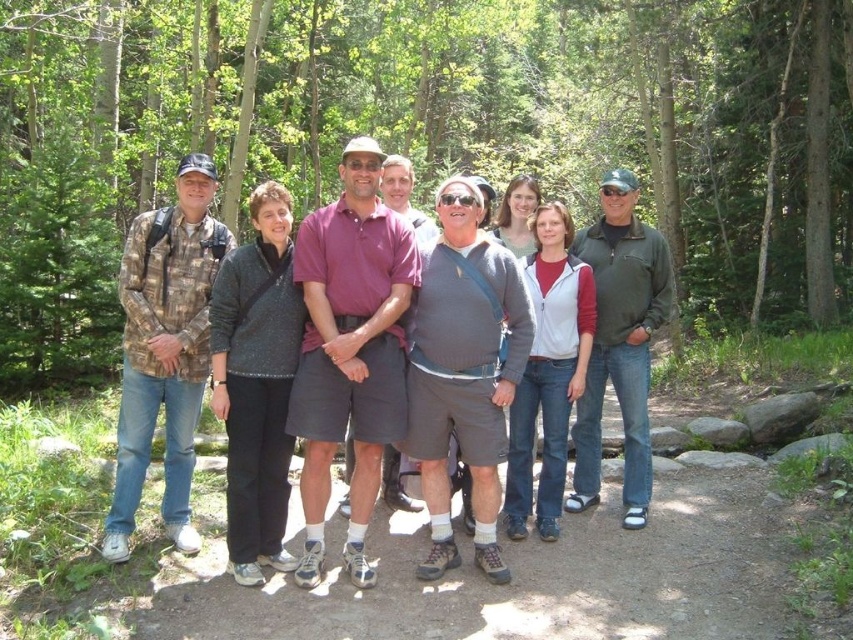
Is green leafy trees at center smaller than camouflage fabric shirt at left?

No.

Does green leafy trees at center appear over camouflage fabric shirt at left?

Yes, green leafy trees at center is above camouflage fabric shirt at left.

Which is in front, point (119, 256) or point (378, 392)?

Point (378, 392) is in front.

In order to click on green leafy trees at center in this screenshot , I will do `click(426, 136)`.